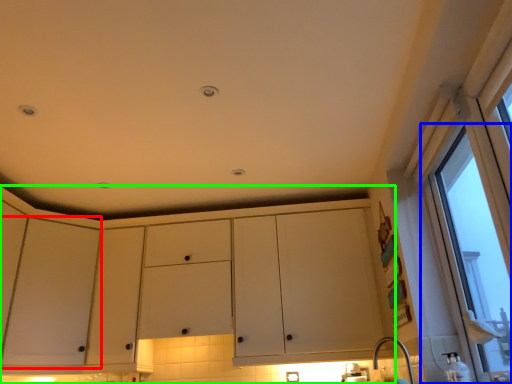
Question: Which object is positioned farthest from screen door (highlighted by a red box)? Select from window (highlighted by a blue box) and cabinetry (highlighted by a green box).

Choices:
 (A) window
 (B) cabinetry

Answer: (A)